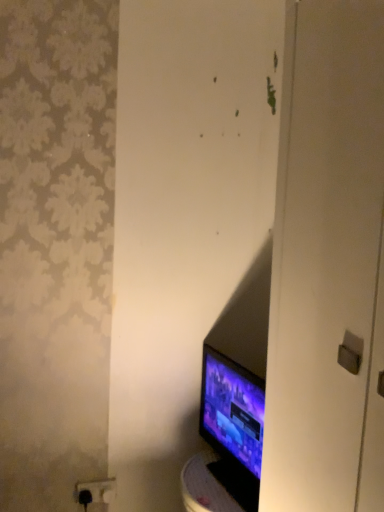
Describe the element at coordinates (95, 492) in the screenshot. Image resolution: width=384 pixels, height=512 pixels. I see `black plastic outlet at lower left` at that location.

Locate an element on the screen. The image size is (384, 512). black plastic outlet at lower left is located at coordinates (95, 492).

Describe the element at coordinates (233, 425) in the screenshot. The height and width of the screenshot is (512, 384). I see `matte black monitor at lower right` at that location.

Identify the location of matte black monitor at lower right. (233, 425).

Find the location of a particular element. The image size is (384, 512). black plastic outlet at lower left is located at coordinates (95, 492).

Considering the relative positions of matte black monitor at lower right and black plastic outlet at lower left in the image provided, is matte black monitor at lower right to the left of black plastic outlet at lower left from the viewer's perspective?

Incorrect, matte black monitor at lower right is not on the left side of black plastic outlet at lower left.

Which object is closer to the camera taking this photo, matte black monitor at lower right or black plastic outlet at lower left?

matte black monitor at lower right.

Which is in front, point (250, 492) or point (82, 500)?

The point (250, 492) is closer to the camera.

From the picture: From the image's perspective, is matte black monitor at lower right located beneath black plastic outlet at lower left?

Incorrect, from the image's perspective, matte black monitor at lower right is higher than black plastic outlet at lower left.

From a real-world perspective, who is located lower, matte black monitor at lower right or black plastic outlet at lower left?

In real-world perspective, black plastic outlet at lower left is lower.

Between matte black monitor at lower right and black plastic outlet at lower left, which one has larger width?

matte black monitor at lower right.

Who is taller, matte black monitor at lower right or black plastic outlet at lower left?

With more height is matte black monitor at lower right.

Based on their sizes in the image, would you say matte black monitor at lower right is bigger or smaller than black plastic outlet at lower left?

matte black monitor at lower right is bigger than black plastic outlet at lower left.

Would you say matte black monitor at lower right is outside black plastic outlet at lower left?

Yes.

Is matte black monitor at lower right touching black plastic outlet at lower left?

matte black monitor at lower right and black plastic outlet at lower left are clearly separated.

Is matte black monitor at lower right facing away from black plastic outlet at lower left?

No, matte black monitor at lower right is not facing away from black plastic outlet at lower left.

What's the angular difference between matte black monitor at lower right and black plastic outlet at lower left's facing directions?

The facing directions of matte black monitor at lower right and black plastic outlet at lower left are 73.6 degrees apart.

Find the location of a particular element. electric outlet below the matte black monitor at lower right (from a real-world perspective) is located at coordinates (95, 492).

Can you confirm if black plastic outlet at lower left is positioned to the right of matte black monitor at lower right?

No.

In the image, is black plastic outlet at lower left positioned in front of or behind matte black monitor at lower right?

Clearly, black plastic outlet at lower left is behind matte black monitor at lower right.

Between point (100, 486) and point (242, 410), which one is positioned in front?

The point (242, 410) is in front.

From the image's perspective, which object appears higher, black plastic outlet at lower left or matte black monitor at lower right?

From the image's view, matte black monitor at lower right is above.

From a real-world perspective, is black plastic outlet at lower left above or below matte black monitor at lower right?

black plastic outlet at lower left is situated lower than matte black monitor at lower right in the real world.

Considering the sizes of objects black plastic outlet at lower left and matte black monitor at lower right in the image provided, who is wider, black plastic outlet at lower left or matte black monitor at lower right?

Wider between the two is matte black monitor at lower right.

Considering the sizes of black plastic outlet at lower left and matte black monitor at lower right in the image, is black plastic outlet at lower left taller or shorter than matte black monitor at lower right?

Considering their sizes, black plastic outlet at lower left has less height than matte black monitor at lower right.

Between black plastic outlet at lower left and matte black monitor at lower right, which one has smaller size?

Smaller between the two is black plastic outlet at lower left.

Is black plastic outlet at lower left not inside matte black monitor at lower right?

Yes.

Is black plastic outlet at lower left far away from matte black monitor at lower right?

No.

Could you tell me if black plastic outlet at lower left is facing matte black monitor at lower right?

No, black plastic outlet at lower left is not facing towards matte black monitor at lower right.

The height and width of the screenshot is (512, 384). In order to click on computer monitor in front of the black plastic outlet at lower left in this screenshot , I will do `click(233, 425)`.

At what (x,y) coordinates should I click in order to perform the action: click on electric outlet on the left of matte black monitor at lower right. Please return your answer as a coordinate pair (x, y). The height and width of the screenshot is (512, 384). Looking at the image, I should click on (95, 492).

This screenshot has height=512, width=384. I want to click on computer monitor in front of the black plastic outlet at lower left, so click(x=233, y=425).